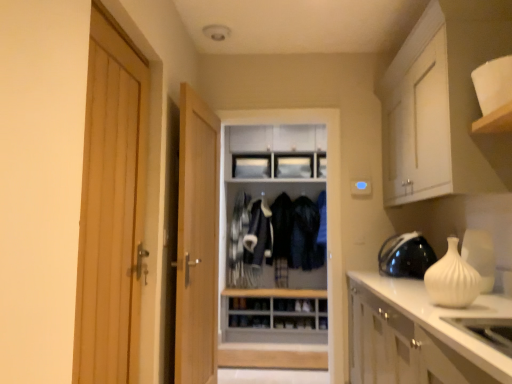
Question: Visually, is black glossy helmet at right positioned to the left or to the right of light wood door at left, marked as the 2th door in a back-to-front arrangement?

Choices:
 (A) right
 (B) left

Answer: (A)

Question: Is black glossy helmet at right bigger or smaller than light wood door at left, marked as the 2th door in a back-to-front arrangement?

Choices:
 (A) big
 (B) small

Answer: (B)

Question: Which object is the farthest from the white matte vase at right?

Choices:
 (A) light wood door at center, marked as the 2th door in a front-to-back arrangement
 (B) wooden dresser at center
 (C) light wood door at left, marked as the 2th door in a back-to-front arrangement
 (D) dark blue fabric jacket at center, the 2th clothing when ordered from right to left
 (E) dark blue fabric jacket at center, the first clothing when ordered from right to left

Answer: (D)

Question: Considering the real-world distances, which object is farthest from the light wood door at left, which is the first door from left to right?

Choices:
 (A) dark blue fabric jacket at center, which is the 1th clothing from left to right
 (B) light wood door at center, which ranks as the first door in back-to-front order
 (C) dark blue fabric jacket at center, acting as the second clothing starting from the left
 (D) white matte vase at right
 (E) black glossy helmet at right

Answer: (C)